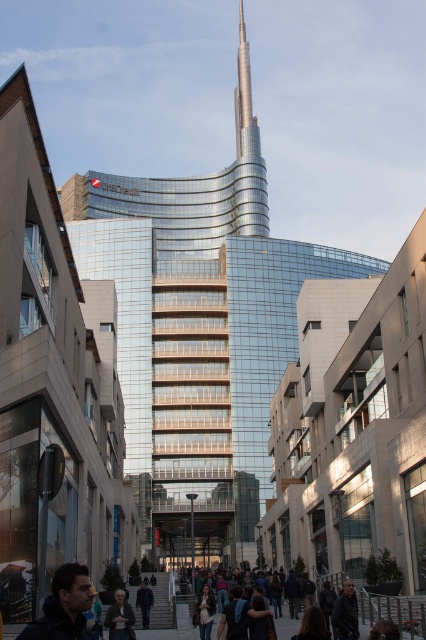
What do you see at coordinates (198, 337) in the screenshot?
I see `glassy metallic tower at center` at bounding box center [198, 337].

Does glassy metallic tower at center have a lesser width compared to dark gray jacket at center?

No.

Identify the location of glassy metallic tower at center. (198, 337).

Image resolution: width=426 pixels, height=640 pixels. I want to click on glassy metallic tower at center, so click(198, 337).

Which is more to the left, gold metallic spire at center or dark gray jacket at center?

From the viewer's perspective, dark gray jacket at center appears more on the left side.

Is gold metallic spire at center to the right of dark gray jacket at center from the viewer's perspective?

Correct, you'll find gold metallic spire at center to the right of dark gray jacket at center.

Find the location of a particular element. The width and height of the screenshot is (426, 640). gold metallic spire at center is located at coordinates (242, 86).

Is dark blue jacket at lower left below dark brown leather jacket at lower center?

Actually, dark blue jacket at lower left is above dark brown leather jacket at lower center.

Where is `dark blue jacket at lower left`? dark blue jacket at lower left is located at coordinates (63, 605).